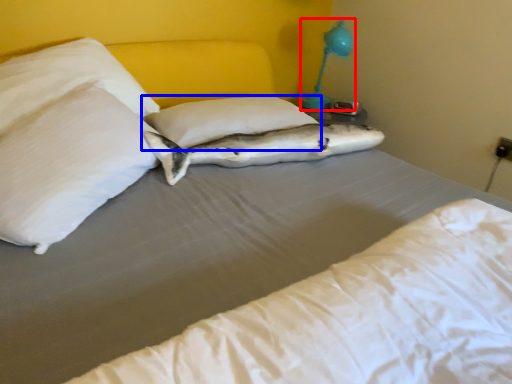
Question: Which object appears closest to the camera in this image, bedside lamp (highlighted by a red box) or pillow (highlighted by a blue box)?

Choices:
 (A) bedside lamp
 (B) pillow

Answer: (B)